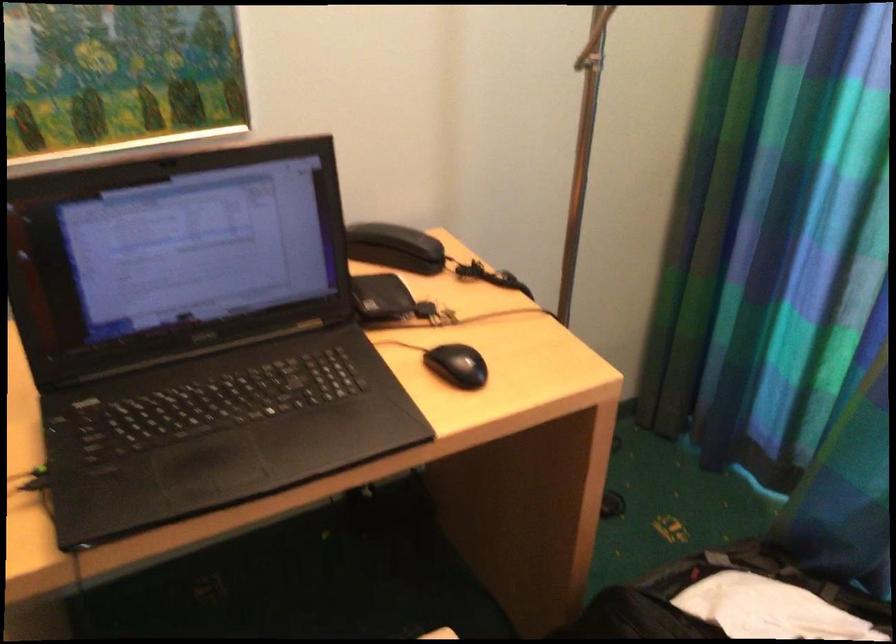
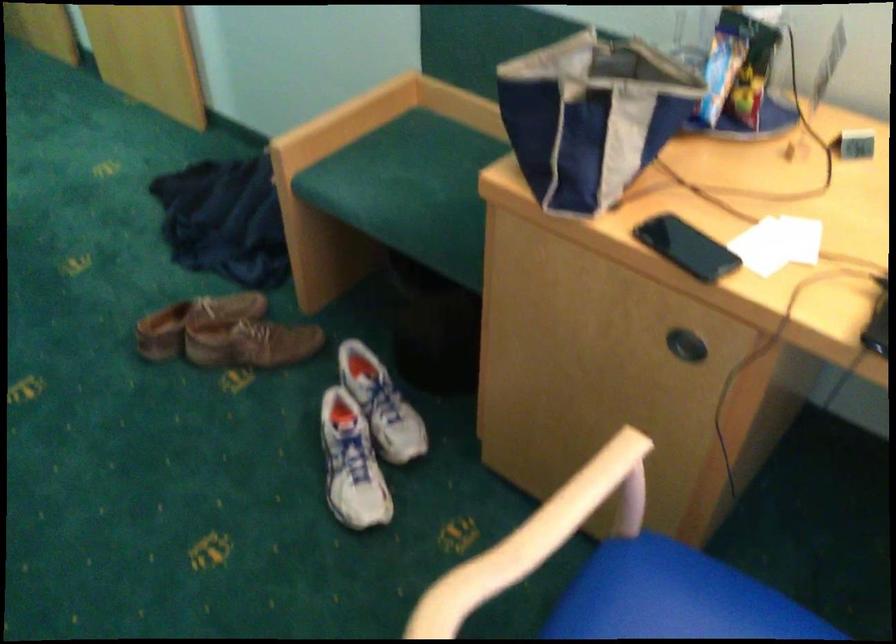
First-person continuous shooting, in which direction is the camera rotating?

The camera's rotation is toward left-down.